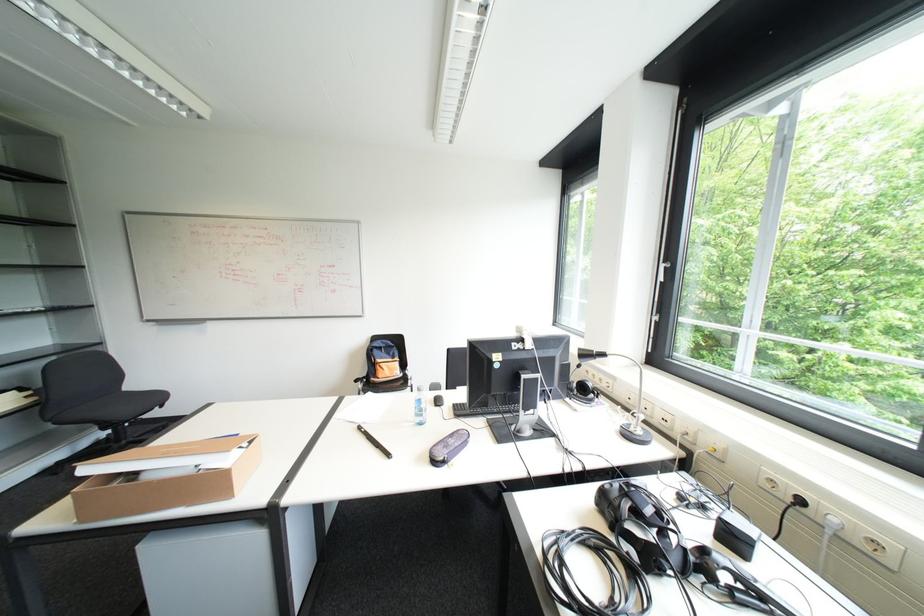
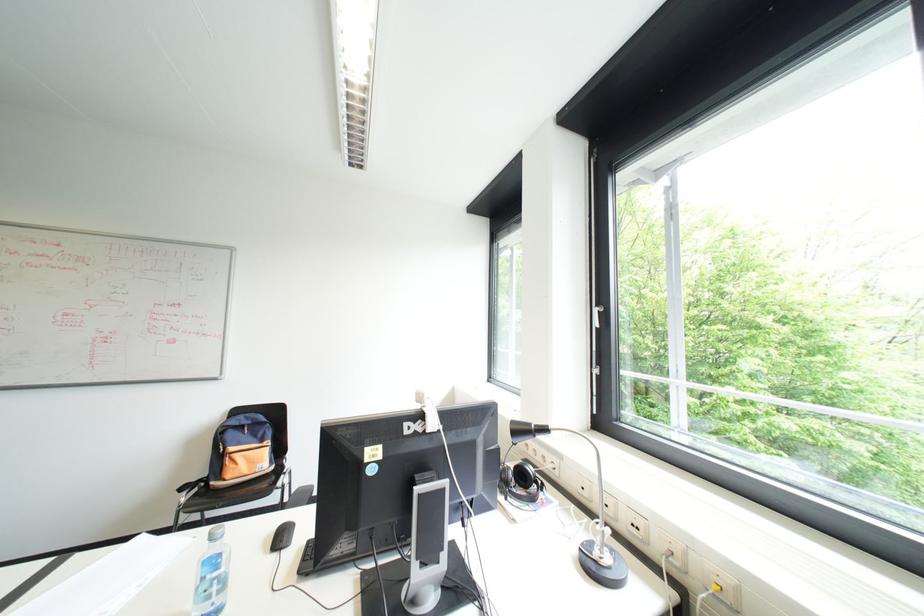
Question: The images are taken continuously from a first-person perspective. In which direction is your viewpoint rotating?

Choices:
 (A) Left
 (B) Right
 (C) Up
 (D) Down

Answer: (B)